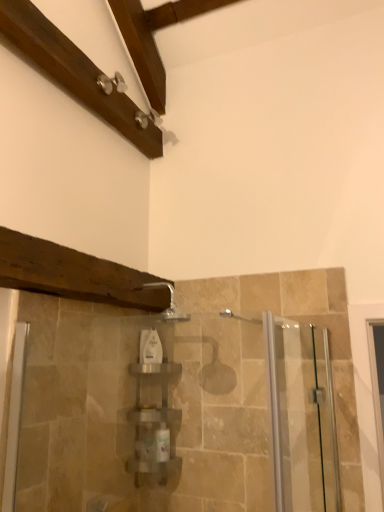
Describe the element at coordinates (150, 347) in the screenshot. I see `white glossy bottle at center` at that location.

Image resolution: width=384 pixels, height=512 pixels. What do you see at coordinates (170, 303) in the screenshot?
I see `silver metallic faucet at upper center` at bounding box center [170, 303].

Locate an element on the screen. This screenshot has width=384, height=512. clear glass screen door at right is located at coordinates (302, 417).

Is white glossy bottle at center not near silver metallic faucet at upper center?

white glossy bottle at center is near silver metallic faucet at upper center, not far away.

Looking at this image, which object is wider, white glossy bottle at center or silver metallic faucet at upper center?

silver metallic faucet at upper center.

From the image's perspective, is white glossy bottle at center above silver metallic faucet at upper center?

No, from the image's perspective, white glossy bottle at center is not over silver metallic faucet at upper center.

Between point (147, 342) and point (175, 316), which one is positioned behind?

Positioned behind is point (175, 316).

Is white glossy bottle at center oriented towards clear plastic shelf at center?

No, white glossy bottle at center is not facing towards clear plastic shelf at center.

Considering the relative sizes of white glossy bottle at center and clear plastic shelf at center in the image provided, is white glossy bottle at center wider than clear plastic shelf at center?

No, white glossy bottle at center is not wider than clear plastic shelf at center.

Which is more to the left, white glossy bottle at center or clear plastic shelf at center?

white glossy bottle at center.

Based on the photo, from a real-world perspective, is silver metallic faucet at upper center located beneath white glossy bottle at center?

No, from a real-world perspective, silver metallic faucet at upper center is not beneath white glossy bottle at center.

Measure the distance from silver metallic faucet at upper center to white glossy bottle at center.

The distance of silver metallic faucet at upper center from white glossy bottle at center is 7.02 inches.

Can you tell me how much silver metallic faucet at upper center and white glossy bottle at center differ in facing direction?

There is a 6.56-degree angle between the facing directions of silver metallic faucet at upper center and white glossy bottle at center.

Based on the photo, from the image's perspective, is silver metallic faucet at upper center located above or below white glossy bottle at center?

Clearly, from the image's perspective, silver metallic faucet at upper center is above white glossy bottle at center.

From the image's perspective, is clear glass screen door at right below silver metallic faucet at upper center?

Correct, clear glass screen door at right appears lower than silver metallic faucet at upper center in the image.

Considering the sizes of objects clear glass screen door at right and silver metallic faucet at upper center in the image provided, who is thinner, clear glass screen door at right or silver metallic faucet at upper center?

Thinner between the two is clear glass screen door at right.

How much distance is there between clear glass screen door at right and silver metallic faucet at upper center?

clear glass screen door at right is 26.07 inches away from silver metallic faucet at upper center.

Does silver metallic faucet at upper center come behind clear plastic shelf at center?

No.

At what (x,y) coordinates should I click in order to perform the action: click on shower above the clear plastic shelf at center (from a real-world perspective). Please return your answer as a coordinate pair (x, y). The width and height of the screenshot is (384, 512). Looking at the image, I should click on (170, 303).

Measure the distance between silver metallic faucet at upper center and clear plastic shelf at center.

silver metallic faucet at upper center is 18.15 inches from clear plastic shelf at center.

Is silver metallic faucet at upper center outside of clear plastic shelf at center?

Yes.

Is clear plastic shelf at center looking in the opposite direction of white glossy bottle at center?

No, clear plastic shelf at center's orientation is not away from white glossy bottle at center.

In the scene shown: Who is more distant, clear plastic shelf at center or white glossy bottle at center?

white glossy bottle at center.

Could white glossy bottle at center be considered to be inside clear plastic shelf at center?

Definitely not — white glossy bottle at center is not inside clear plastic shelf at center.

Is clear plastic shelf at center in contact with silver metallic faucet at upper center?

No, clear plastic shelf at center is not with silver metallic faucet at upper center.

Which of these two, clear plastic shelf at center or silver metallic faucet at upper center, is smaller?

silver metallic faucet at upper center is smaller.

Consider the image. Is clear plastic shelf at center located outside silver metallic faucet at upper center?

Yes, clear plastic shelf at center is not within silver metallic faucet at upper center.

From the picture: From a real-world perspective, is clear plastic shelf at center physically below silver metallic faucet at upper center?

Indeed, from a real-world perspective, clear plastic shelf at center is positioned beneath silver metallic faucet at upper center.

Identify the location of toiletry beneath the silver metallic faucet at upper center (from a real-world perspective). (150, 347).

Find the location of a particular element. This screenshot has width=384, height=512. toiletry to the left of clear plastic shelf at center is located at coordinates point(150,347).

Considering their positions, is clear plastic shelf at center positioned further to clear glass screen door at right than silver metallic faucet at upper center?

The object further to clear glass screen door at right is silver metallic faucet at upper center.

Considering their positions, is clear glass screen door at right positioned further to silver metallic faucet at upper center than clear plastic shelf at center?

clear glass screen door at right is further to silver metallic faucet at upper center.

From the image, which object appears to be farther from white glossy bottle at center, clear glass screen door at right or clear plastic shelf at center?

Among the two, clear glass screen door at right is located further to white glossy bottle at center.

From the image, which object appears to be nearer to white glossy bottle at center, clear glass screen door at right or silver metallic faucet at upper center?

Based on the image, silver metallic faucet at upper center appears to be nearer to white glossy bottle at center.

Considering their positions, is clear glass screen door at right positioned closer to clear plastic shelf at center than silver metallic faucet at upper center?

silver metallic faucet at upper center is positioned closer to the anchor clear plastic shelf at center.

Estimate the real-world distances between objects in this image. Which object is closer to clear glass screen door at right, clear plastic shelf at center or white glossy bottle at center?

The object closer to clear glass screen door at right is clear plastic shelf at center.

From the image, which object appears to be farther from silver metallic faucet at upper center, white glossy bottle at center or clear plastic shelf at center?

clear plastic shelf at center lies further to silver metallic faucet at upper center than the other object.

When comparing their distances from clear plastic shelf at center, does white glossy bottle at center or silver metallic faucet at upper center seem further?

silver metallic faucet at upper center lies further to clear plastic shelf at center than the other object.

I want to click on shelf between clear glass screen door at right and white glossy bottle at center in the front-back direction, so click(x=154, y=424).

Identify the location of toiletry between silver metallic faucet at upper center and clear plastic shelf at center vertically. (150, 347).

I want to click on shower positioned between clear glass screen door at right and white glossy bottle at center from near to far, so click(170, 303).

What are the coordinates of `shower located between clear glass screen door at right and clear plastic shelf at center in the depth direction` in the screenshot? It's located at (170, 303).